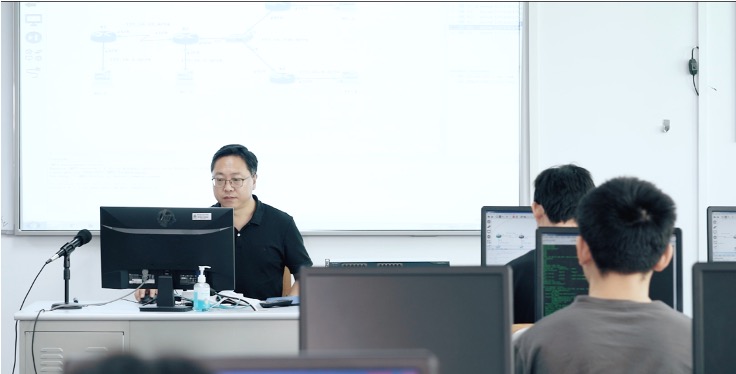
The image size is (736, 374). In order to click on switch in this screenshot , I will do `click(665, 129)`.